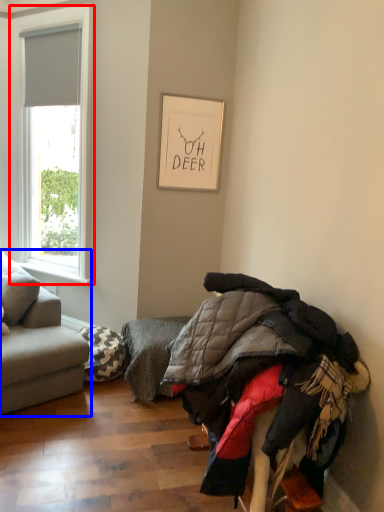
Question: Among these objects, which one is farthest to the camera, window (highlighted by a red box) or studio couch (highlighted by a blue box)?

Choices:
 (A) window
 (B) studio couch

Answer: (A)